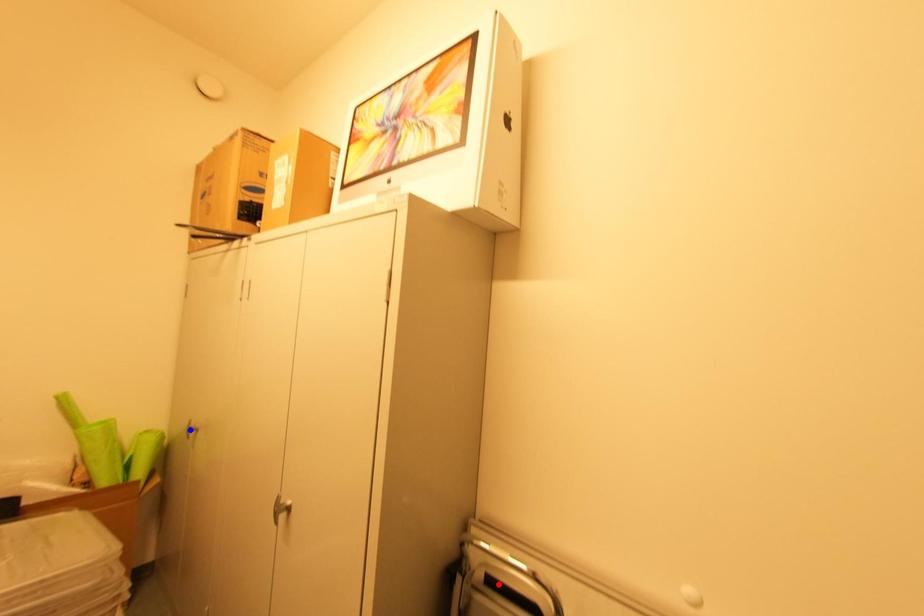
Question: In the image, two points are highlighted. Which point is nearer to the camera? Reply with the corresponding letter.

Choices:
 (A) blue point
 (B) red point

Answer: (B)